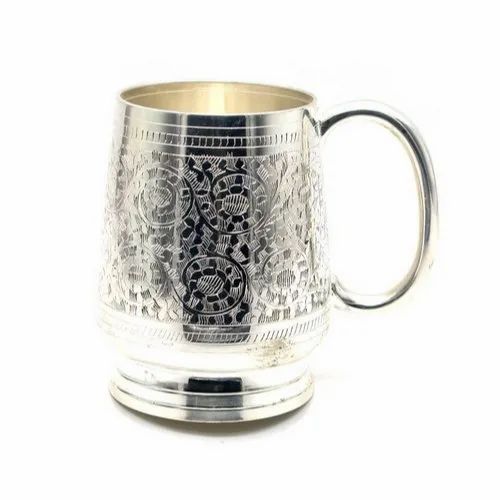
Find the location of `mug`. mug is located at coordinates (220, 285).